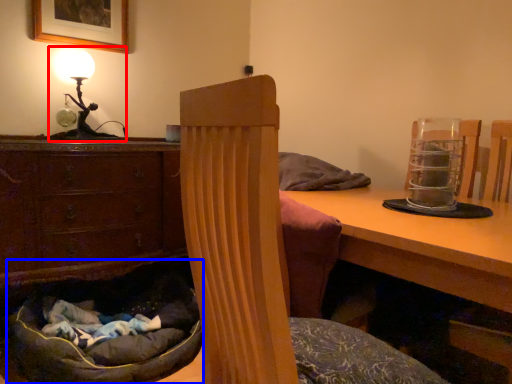
Question: Which of the following is the farthest to the observer, table lamp (highlighted by a red box) or bean bag chair (highlighted by a blue box)?

Choices:
 (A) table lamp
 (B) bean bag chair

Answer: (A)